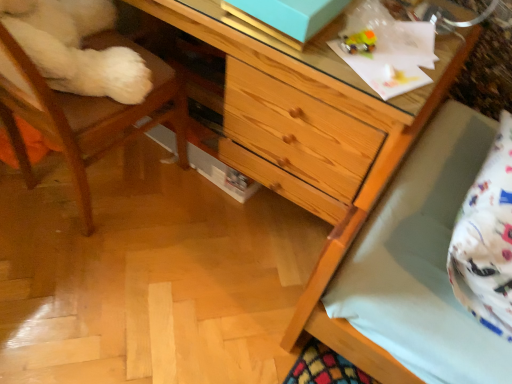
Question: Does wooden chair at left lie behind wooden chest of drawers at center?

Choices:
 (A) yes
 (B) no

Answer: (B)

Question: Considering the relative sizes of wooden chair at left and wooden chest of drawers at center in the image provided, is wooden chair at left taller than wooden chest of drawers at center?

Choices:
 (A) yes
 (B) no

Answer: (A)

Question: Does wooden chair at left touch wooden chest of drawers at center?

Choices:
 (A) no
 (B) yes

Answer: (A)

Question: Considering the relative sizes of wooden chair at left and wooden chest of drawers at center in the image provided, is wooden chair at left bigger than wooden chest of drawers at center?

Choices:
 (A) no
 (B) yes

Answer: (A)

Question: Does wooden chair at left have a greater width compared to wooden chest of drawers at center?

Choices:
 (A) no
 (B) yes

Answer: (A)

Question: Would you say wooden chair at left is inside or outside translucent plastic toy at upper right?

Choices:
 (A) outside
 (B) inside

Answer: (A)

Question: Considering their positions, is wooden chair at left located in front of or behind translucent plastic toy at upper right?

Choices:
 (A) behind
 (B) front

Answer: (B)

Question: From the image's perspective, is wooden chair at left located above or below translucent plastic toy at upper right?

Choices:
 (A) below
 (B) above

Answer: (A)

Question: Is wooden chair at left taller or shorter than translucent plastic toy at upper right?

Choices:
 (A) short
 (B) tall

Answer: (B)

Question: From a real-world perspective, is translucent plastic toy at upper right physically located above or below wooden chest of drawers at center?

Choices:
 (A) below
 (B) above

Answer: (B)

Question: Considering their positions, is translucent plastic toy at upper right located in front of or behind wooden chest of drawers at center?

Choices:
 (A) front
 (B) behind

Answer: (B)

Question: Is translucent plastic toy at upper right bigger or smaller than wooden chest of drawers at center?

Choices:
 (A) small
 (B) big

Answer: (A)

Question: Which is correct: translucent plastic toy at upper right is inside wooden chest of drawers at center, or outside of it?

Choices:
 (A) outside
 (B) inside

Answer: (B)

Question: From the image's perspective, is translucent plastic toy at upper right above or below wooden chair at left?

Choices:
 (A) above
 (B) below

Answer: (A)

Question: Is translucent plastic toy at upper right situated inside wooden chair at left or outside?

Choices:
 (A) inside
 (B) outside

Answer: (B)